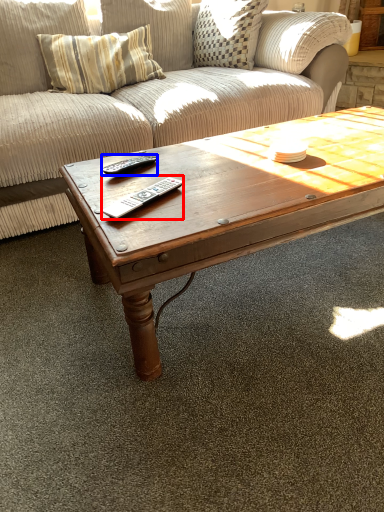
Question: Which object appears farthest to the camera in this image, remote (highlighted by a red box) or remote (highlighted by a blue box)?

Choices:
 (A) remote
 (B) remote

Answer: (B)